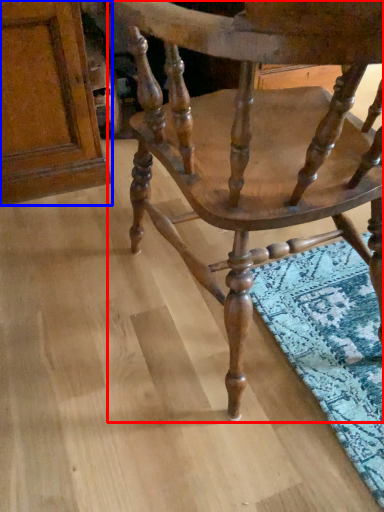
Question: Which object is closer to the camera taking this photo, chair (highlighted by a red box) or plank (highlighted by a blue box)?

Choices:
 (A) chair
 (B) plank

Answer: (A)